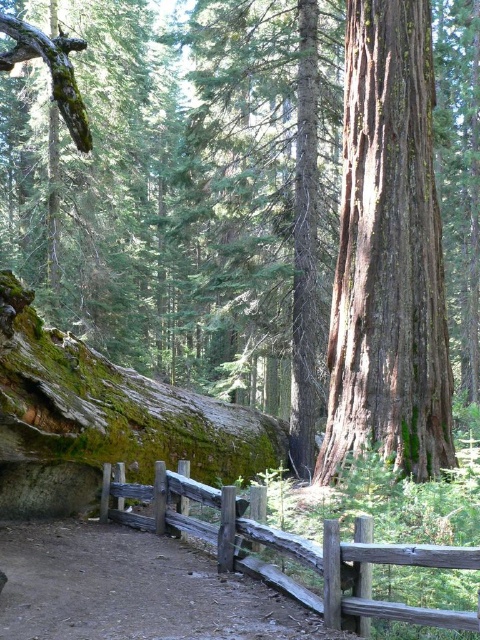
You are a hiker walking along the dirt path at center and want to reach the weathered wood fence at lower center. Can you walk directly towards the fence from the path without going around?

The weathered wood fence at lower center is behind the dirt path at center, so you can walk directly towards the fence from the path without needing to go around it.

You are a hiker with a 2.5 meter wide camping trailer. You come across the dirt path at center and the weathered wood fence at lower center. Can your trailer pass through the narrower of the two?

The dirt path at center is wider than the weathered wood fence at lower center. The narrower of the two is the weathered wood fence at lower center. Since the trailer is 2.5 meters wide, you need to check if the fence is wider than 2.5 meters. However, the description only states the path is wider than the fence, but does not provide specific measurements. Therefore, it is unclear if the fence is wide enough for the trailer to pass through.

You are standing in the forest scene described. There is a point marked at coordinates (x=388, y=253). What object is located at this point?

The point at coordinates (x=388, y=253) indicates smooth brown bark at center.